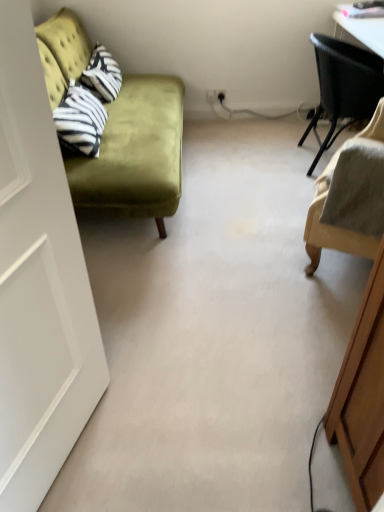
This screenshot has height=512, width=384. What are the coordinates of `white matte door at left` in the screenshot? It's located at (39, 284).

The height and width of the screenshot is (512, 384). What do you see at coordinates (344, 86) in the screenshot?
I see `black woven chair at upper right, the 1th chair from the top` at bounding box center [344, 86].

Identify the location of white matte door at left. (39, 284).

In terms of width, does velvet green couch at left look wider or thinner when compared to beige fabric chair at right, the first chair in the bottom-to-top sequence?

In the image, velvet green couch at left appears to be wider than beige fabric chair at right, the first chair in the bottom-to-top sequence.

Is velvet green couch at left located outside beige fabric chair at right, marked as the 1th chair in a front-to-back arrangement?

velvet green couch at left lies outside beige fabric chair at right, marked as the 1th chair in a front-to-back arrangement,'s area.

Is velvet green couch at left facing towards beige fabric chair at right, marked as the 1th chair in a front-to-back arrangement?

Yes, velvet green couch at left is aimed at beige fabric chair at right, marked as the 1th chair in a front-to-back arrangement.

From a real-world perspective, which is physically above, velvet green couch at left or beige fabric chair at right, which ranks as the second chair in top-to-bottom order?

In real-world perspective, beige fabric chair at right, which ranks as the second chair in top-to-bottom order, is above.

Consider the image. Is black woven chair at upper right, positioned as the 1th chair in back-to-front order, to the left of velvet green couch at left from the viewer's perspective?

No, black woven chair at upper right, positioned as the 1th chair in back-to-front order, is not to the left of velvet green couch at left.

There is a black woven chair at upper right, the 1th chair from the top. In order to click on studio couch above it (from a real-world perspective) in this screenshot , I will do `click(136, 153)`.

From the image's perspective, is black woven chair at upper right, positioned as the 1th chair in back-to-front order, on velvet green couch at left?

Yes, from the image's perspective, black woven chair at upper right, positioned as the 1th chair in back-to-front order, is above velvet green couch at left.

Can you confirm if black woven chair at upper right, arranged as the second chair when ordered from the bottom, is taller than velvet green couch at left?

No.

Does black woven chair at upper right, acting as the 2th chair starting from the front, have a smaller size compared to white matte door at left?

Actually, black woven chair at upper right, acting as the 2th chair starting from the front, might be larger than white matte door at left.

Is point (327, 41) positioned in front of point (1, 93)?

No, (327, 41) is behind (1, 93).

Does black woven chair at upper right, the 1th chair from the top, have a lesser height compared to white matte door at left?

Yes, black woven chair at upper right, the 1th chair from the top, is shorter than white matte door at left.

Would you say white matte door at left is inside or outside velvet green couch at left?

white matte door at left lies outside velvet green couch at left.

Does white matte door at left have a lesser height compared to velvet green couch at left?

No.

Is white matte door at left aimed at velvet green couch at left?

No.

Which is more to the right, white matte door at left or velvet green couch at left?

white matte door at left is more to the right.

From a real-world perspective, is velvet green couch at left physically above white matte door at left?

No, from a real-world perspective, velvet green couch at left is not above white matte door at left.

Is velvet green couch at left aimed at white matte door at left?

No.

From the image's perspective, is velvet green couch at left below white matte door at left?

No.

From a real-world perspective, is beige fabric chair at right, which ranks as the second chair in top-to-bottom order, over black woven chair at upper right, the 1th chair from the top?

Yes, from a real-world perspective, beige fabric chair at right, which ranks as the second chair in top-to-bottom order, is above black woven chair at upper right, the 1th chair from the top.

How much distance is there between beige fabric chair at right, the first chair in the bottom-to-top sequence, and black woven chair at upper right, the 1th chair from the top?

beige fabric chair at right, the first chair in the bottom-to-top sequence, is 34.91 inches from black woven chair at upper right, the 1th chair from the top.

What are the coordinates of `chair that appears on the right of beige fabric chair at right, marked as the 1th chair in a front-to-back arrangement` in the screenshot? It's located at (344, 86).

From the image's perspective, is beige fabric chair at right, marked as the 1th chair in a front-to-back arrangement, located above or below black woven chair at upper right, acting as the 2th chair starting from the front?

beige fabric chair at right, marked as the 1th chair in a front-to-back arrangement, is below black woven chair at upper right, acting as the 2th chair starting from the front.

Is white matte door at left not close to beige fabric chair at right, the first chair in the bottom-to-top sequence?

Yes.

Consider the image. From the image's perspective, is white matte door at left located beneath beige fabric chair at right, the second chair from the back?

Yes, from the image's perspective, white matte door at left is below beige fabric chair at right, the second chair from the back.

Which of these two, white matte door at left or beige fabric chair at right, which ranks as the second chair in top-to-bottom order, is wider?

With larger width is beige fabric chair at right, which ranks as the second chair in top-to-bottom order.

Is white matte door at left positioned with its back to beige fabric chair at right, the second chair from the back?

white matte door at left does not have its back to beige fabric chair at right, the second chair from the back.

The height and width of the screenshot is (512, 384). In order to click on chair that is below the velvet green couch at left (from the image's perspective) in this screenshot , I will do `click(332, 228)`.

The width and height of the screenshot is (384, 512). I want to click on chair behind the velvet green couch at left, so click(x=344, y=86).

Based on their spatial positions, is beige fabric chair at right, the first chair in the bottom-to-top sequence, or white matte door at left further from black woven chair at upper right, acting as the 2th chair starting from the front?

The object further to black woven chair at upper right, acting as the 2th chair starting from the front, is white matte door at left.

Considering their positions, is black woven chair at upper right, acting as the 2th chair starting from the front, positioned closer to velvet green couch at left than beige fabric chair at right, the first chair in the bottom-to-top sequence?

beige fabric chair at right, the first chair in the bottom-to-top sequence, lies closer to velvet green couch at left than the other object.

Considering their positions, is white matte door at left positioned further to velvet green couch at left than beige fabric chair at right, which ranks as the second chair in top-to-bottom order?

white matte door at left is positioned further to the anchor velvet green couch at left.

Looking at this image, considering their positions, is velvet green couch at left positioned closer to white matte door at left than black woven chair at upper right, the 1th chair from the top?

velvet green couch at left lies closer to white matte door at left than the other object.

Based on their spatial positions, is black woven chair at upper right, the 1th chair from the top, or beige fabric chair at right, which ranks as the second chair in top-to-bottom order, further from white matte door at left?

black woven chair at upper right, the 1th chair from the top, lies further to white matte door at left than the other object.

When comparing their distances from black woven chair at upper right, the 1th chair from the top, does velvet green couch at left or white matte door at left seem further?

white matte door at left is further to black woven chair at upper right, the 1th chair from the top.

Looking at the image, which one is located further to black woven chair at upper right, the 1th chair from the top, white matte door at left or beige fabric chair at right, which ranks as the second chair in top-to-bottom order?

white matte door at left is positioned further to the anchor black woven chair at upper right, the 1th chair from the top.

When comparing their distances from beige fabric chair at right, which ranks as the second chair in top-to-bottom order, does black woven chair at upper right, acting as the 2th chair starting from the front, or velvet green couch at left seem further?

velvet green couch at left.

Where is `chair between white matte door at left and velvet green couch at left from front to back`? The height and width of the screenshot is (512, 384). chair between white matte door at left and velvet green couch at left from front to back is located at coordinates (332, 228).

You are a GUI agent. You are given a task and a screenshot of the screen. Output one action in this format:
    pyautogui.click(x=<x>, y=<y>)
    Task: Click on the chair between velvet green couch at left and black woven chair at upper right, acting as the 2th chair starting from the front, from left to right
    
    Given the screenshot: What is the action you would take?
    pyautogui.click(x=332, y=228)

The width and height of the screenshot is (384, 512). In order to click on studio couch between white matte door at left and black woven chair at upper right, the 1th chair from the top, in the front-back direction in this screenshot , I will do `click(136, 153)`.

This screenshot has height=512, width=384. I want to click on chair between white matte door at left and black woven chair at upper right, acting as the 2th chair starting from the front, along the z-axis, so click(332, 228).